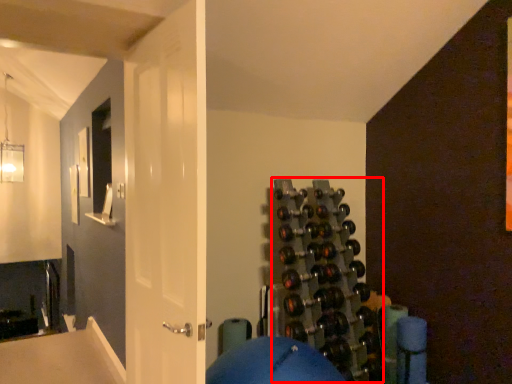
Question: From the image, what is the correct spatial relationship of wine rack (annotated by the red box) in relation to door?

Choices:
 (A) left
 (B) right

Answer: (B)